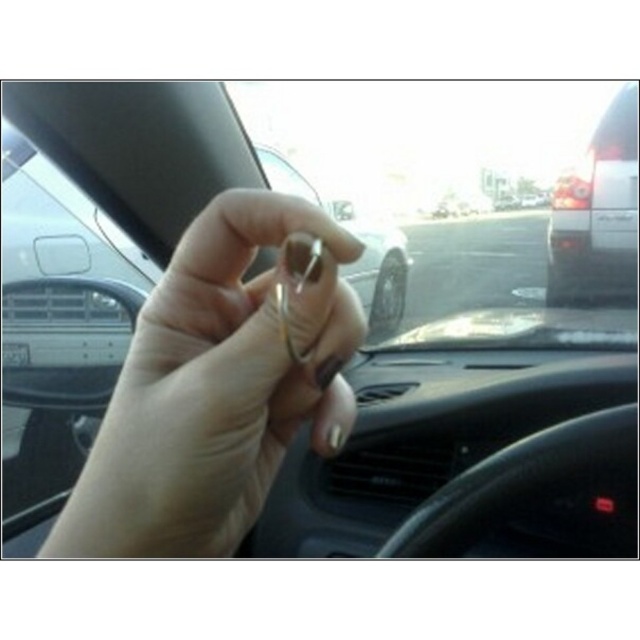
Which is more to the left, white matte van at right or metallic silver key at center?

Positioned to the left is metallic silver key at center.

Is point (624, 128) positioned behind point (355, 228)?

No, (624, 128) is closer to viewer.

Who is more distant from viewer, (589, 243) or (291, 182)?

The point (589, 243) is behind.

The height and width of the screenshot is (640, 640). I want to click on white matte van at right, so click(596, 211).

Between gold metallic ring at center and white matte van at right, which one appears on the right side from the viewer's perspective?

Positioned to the right is white matte van at right.

Who is more distant from viewer, (189, 381) or (602, 257)?

Positioned behind is point (602, 257).

Describe the element at coordinates (216, 388) in the screenshot. The width and height of the screenshot is (640, 640). I see `gold metallic ring at center` at that location.

This screenshot has width=640, height=640. Identify the location of gold metallic ring at center. (216, 388).

Which is in front, point (230, 328) or point (396, 276)?

Positioned in front is point (230, 328).

Describe the element at coordinates (216, 388) in the screenshot. I see `gold metallic ring at center` at that location.

Between point (237, 262) and point (369, 296), which one is positioned in front?

Positioned in front is point (237, 262).

Locate an element on the screen. This screenshot has height=640, width=640. gold metallic ring at center is located at coordinates (216, 388).